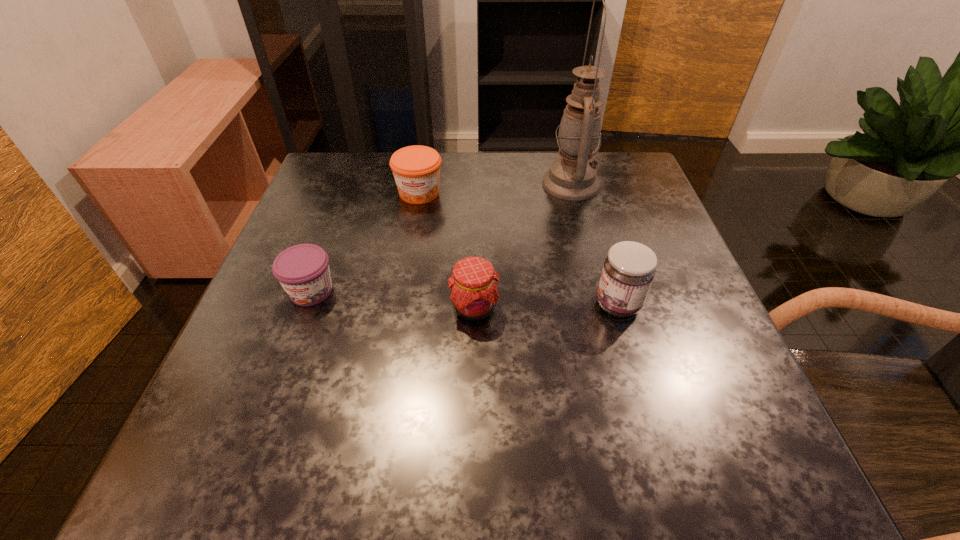
This screenshot has width=960, height=540. In order to click on vacant region located 0.100m on the front label of the fourth shortest object in this screenshot , I will do `click(540, 305)`.

Identify the location of free region located 0.180m on the front label of the fourth shortest object. The image size is (960, 540). (495, 305).

I want to click on vacant space located on the front label of the second jam from left to right, so click(396, 333).

Identify the location of free space located on the left of the third object from left to right. This screenshot has width=960, height=540. (417, 308).

In order to click on vacant position located 0.300m on the front label of the leftmost object in this screenshot , I will do pyautogui.click(x=240, y=484).

Where is `oil lamp that is at the far edge`? Image resolution: width=960 pixels, height=540 pixels. oil lamp that is at the far edge is located at coordinates (572, 177).

Identify the location of jam located in the far edge section of the desktop. The image size is (960, 540). click(416, 169).

In order to click on object that is at the left edge in this screenshot , I will do `click(303, 271)`.

This screenshot has height=540, width=960. I want to click on oil lamp situated at the right edge, so click(572, 177).

The image size is (960, 540). What are the coordinates of `jam present at the right edge` in the screenshot? It's located at (628, 271).